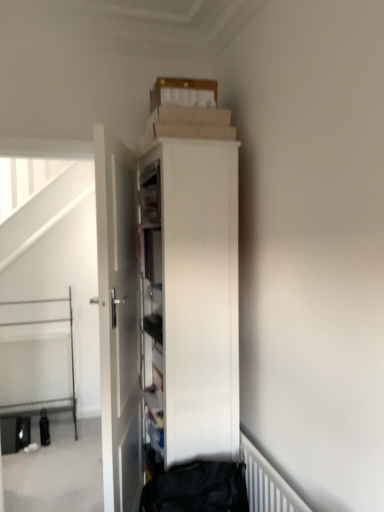
Question: Is white matte radiator at lower right, which ranks as the second radiator in left-to-right order, to the right of white textured radiator at lower left, which appears as the first radiator when viewed from the back, from the viewer's perspective?

Choices:
 (A) no
 (B) yes

Answer: (B)

Question: Is white textured radiator at lower left, which appears as the first radiator when viewed from the back, inside white matte radiator at lower right, which is the 1th radiator from right to left?

Choices:
 (A) no
 (B) yes

Answer: (A)

Question: Considering the relative sizes of white matte radiator at lower right, which is the 1th radiator from right to left, and white textured radiator at lower left, acting as the 2th radiator starting from the front, in the image provided, is white matte radiator at lower right, which is the 1th radiator from right to left, thinner than white textured radiator at lower left, acting as the 2th radiator starting from the front,?

Choices:
 (A) yes
 (B) no

Answer: (A)

Question: From the image's perspective, is white matte radiator at lower right, which is the 1th radiator from right to left, under white textured radiator at lower left, acting as the first radiator starting from the left?

Choices:
 (A) yes
 (B) no

Answer: (B)

Question: Considering the relative sizes of white matte radiator at lower right, which is the 1th radiator from right to left, and white textured radiator at lower left, acting as the first radiator starting from the left, in the image provided, is white matte radiator at lower right, which is the 1th radiator from right to left, wider than white textured radiator at lower left, acting as the first radiator starting from the left,?

Choices:
 (A) yes
 (B) no

Answer: (B)

Question: Is white matte radiator at lower right, which ranks as the second radiator in left-to-right order, located outside white textured radiator at lower left, which appears as the first radiator when viewed from the back?

Choices:
 (A) yes
 (B) no

Answer: (A)

Question: Considering the relative sizes of white textured radiator at lower left, placed as the second radiator when sorted from right to left, and white glossy cabinet at center in the image provided, is white textured radiator at lower left, placed as the second radiator when sorted from right to left, wider than white glossy cabinet at center?

Choices:
 (A) yes
 (B) no

Answer: (B)

Question: Would you consider white textured radiator at lower left, placed as the second radiator when sorted from right to left, to be distant from white glossy cabinet at center?

Choices:
 (A) no
 (B) yes

Answer: (B)

Question: Is white textured radiator at lower left, acting as the first radiator starting from the left, further to the viewer compared to white glossy cabinet at center?

Choices:
 (A) no
 (B) yes

Answer: (B)

Question: From the image's perspective, is white textured radiator at lower left, acting as the 2th radiator starting from the front, beneath white glossy cabinet at center?

Choices:
 (A) no
 (B) yes

Answer: (B)

Question: Considering the relative sizes of white textured radiator at lower left, acting as the 2th radiator starting from the front, and white glossy cabinet at center in the image provided, is white textured radiator at lower left, acting as the 2th radiator starting from the front, taller than white glossy cabinet at center?

Choices:
 (A) no
 (B) yes

Answer: (A)

Question: Considering the relative positions of white textured radiator at lower left, acting as the first radiator starting from the left, and white glossy cabinet at center in the image provided, is white textured radiator at lower left, acting as the first radiator starting from the left, to the right of white glossy cabinet at center from the viewer's perspective?

Choices:
 (A) no
 (B) yes

Answer: (A)

Question: Does white textured radiator at lower left, acting as the first radiator starting from the left, contain white matte radiator at lower right, the 1th radiator from the front?

Choices:
 (A) no
 (B) yes

Answer: (A)